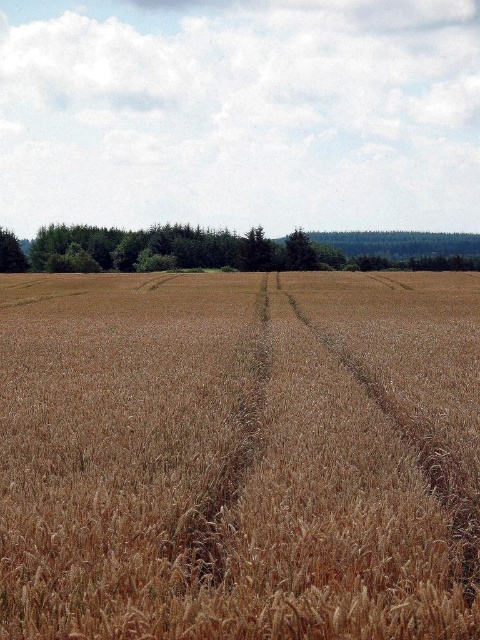
Question: Which point is farther to the camera?

Choices:
 (A) (10, 268)
 (B) (348, 262)
 (C) (67, 429)
 (D) (295, 256)

Answer: (B)

Question: Does golden wheat field at center have a lesser width compared to green leafy tree at left?

Choices:
 (A) yes
 (B) no

Answer: (B)

Question: Does golden wheat field at center have a smaller size compared to green matte tree at center?

Choices:
 (A) no
 (B) yes

Answer: (A)

Question: Which object appears closest to the camera in this image?

Choices:
 (A) green leafy trees at center
 (B) green matte tree at center

Answer: (A)

Question: Which point is farther to the camera?

Choices:
 (A) (420, 300)
 (B) (8, 246)
 (C) (300, 266)
 (D) (140, 260)

Answer: (D)

Question: Does golden wheat field at center appear on the left side of green matte tree at center?

Choices:
 (A) no
 (B) yes

Answer: (B)